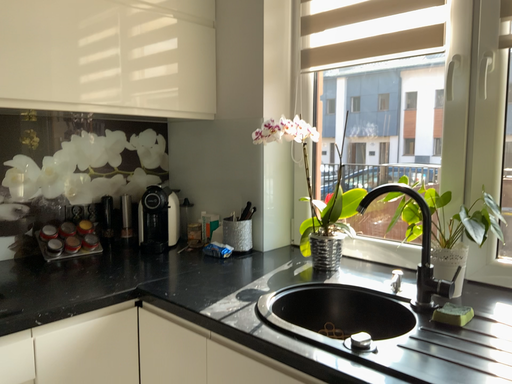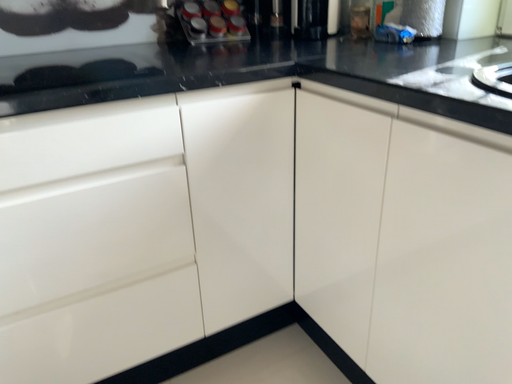
Question: How did the camera likely rotate when shooting the video?

Choices:
 (A) rotated right
 (B) rotated left

Answer: (B)